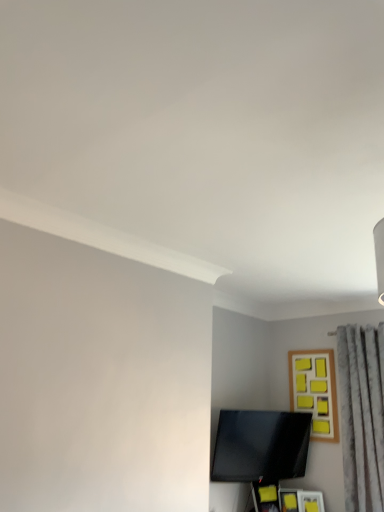
Question: Can we say black glossy tv at lower center lies outside gray textured curtain at right?

Choices:
 (A) no
 (B) yes

Answer: (B)

Question: Would you say gray textured curtain at right is part of black glossy tv at lower center's contents?

Choices:
 (A) no
 (B) yes

Answer: (A)

Question: Are black glossy tv at lower center and gray textured curtain at right located far from each other?

Choices:
 (A) yes
 (B) no

Answer: (B)

Question: From the image's perspective, does black glossy tv at lower center appear lower than gray textured curtain at right?

Choices:
 (A) no
 (B) yes

Answer: (B)

Question: Is black glossy tv at lower center positioned with its back to gray textured curtain at right?

Choices:
 (A) no
 (B) yes

Answer: (A)

Question: Is wooden frame with yellow sticky notes at upper right in front of or behind gray textured curtain at right in the image?

Choices:
 (A) front
 (B) behind

Answer: (B)

Question: In terms of height, does wooden frame with yellow sticky notes at upper right look taller or shorter compared to gray textured curtain at right?

Choices:
 (A) tall
 (B) short

Answer: (B)

Question: From the image's perspective, relative to gray textured curtain at right, is wooden frame with yellow sticky notes at upper right above or below?

Choices:
 (A) above
 (B) below

Answer: (A)

Question: Looking at the image, does wooden frame with yellow sticky notes at upper right seem bigger or smaller compared to gray textured curtain at right?

Choices:
 (A) big
 (B) small

Answer: (B)

Question: In the image, is gray textured curtain at right on the left side or the right side of black glossy tv at lower center?

Choices:
 (A) left
 (B) right

Answer: (B)

Question: From a real-world perspective, is gray textured curtain at right positioned above or below black glossy tv at lower center?

Choices:
 (A) below
 (B) above

Answer: (B)

Question: Is gray textured curtain at right wider or thinner than black glossy tv at lower center?

Choices:
 (A) thin
 (B) wide

Answer: (B)

Question: Relative to black glossy tv at lower center, is gray textured curtain at right in front or behind?

Choices:
 (A) front
 (B) behind

Answer: (A)

Question: Considering the positions of point (365, 368) and point (309, 370), is point (365, 368) closer or farther from the camera than point (309, 370)?

Choices:
 (A) farther
 (B) closer

Answer: (B)

Question: From a real-world perspective, is gray textured curtain at right physically located above or below wooden frame with yellow sticky notes at upper right?

Choices:
 (A) above
 (B) below

Answer: (B)